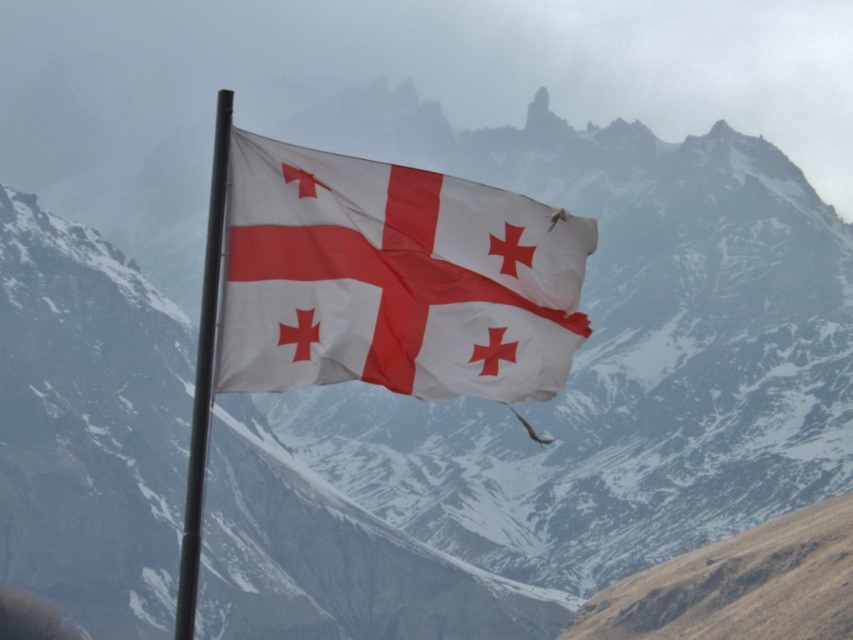
Question: Does white fabric flag at center come behind black metal flag pole at center?

Choices:
 (A) yes
 (B) no

Answer: (A)

Question: Does white fabric flag at center appear on the right side of black metal flag pole at center?

Choices:
 (A) yes
 (B) no

Answer: (A)

Question: Does white fabric flag at center appear on the left side of black metal flag pole at center?

Choices:
 (A) no
 (B) yes

Answer: (A)

Question: Among these points, which one is nearest to the camera?

Choices:
 (A) (378, 234)
 (B) (213, 314)

Answer: (B)